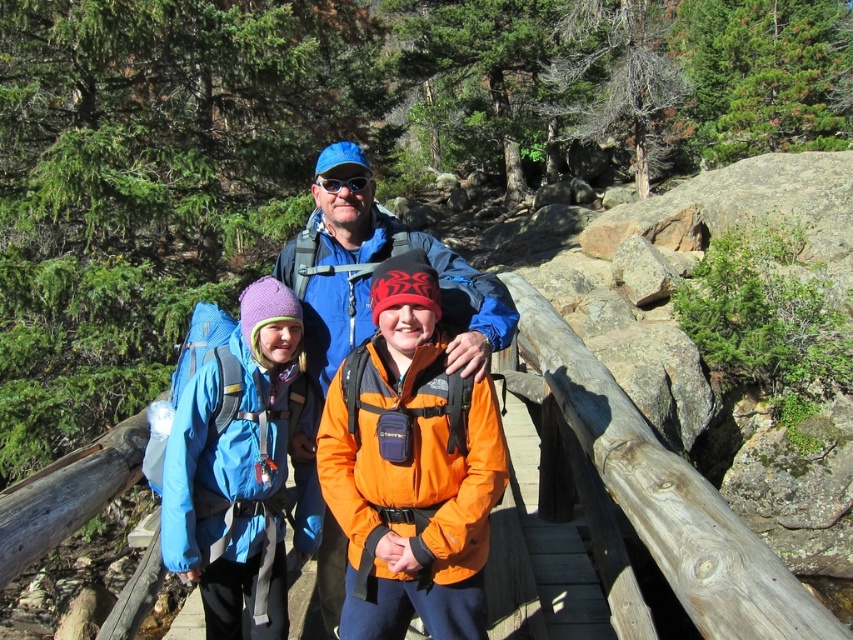
You are a hiker planning to cross the wooden bridge. You notice the blue fabric backpack at center and the blue fabric jacket at center. Which item is positioned to the left of the other?

The blue fabric backpack at center is to the left of the blue fabric jacket at center.

You are planning to carry a heavy camping gear. You have two items from the image to choose from. Which item between the blue fabric backpack at center and the blue fabric jacket at center is more suitable for carrying the gear?

The blue fabric backpack at center is more suitable for carrying heavy camping gear because it is designed for carrying items, whereas the blue fabric jacket at center is clothing and not meant for carrying gear.